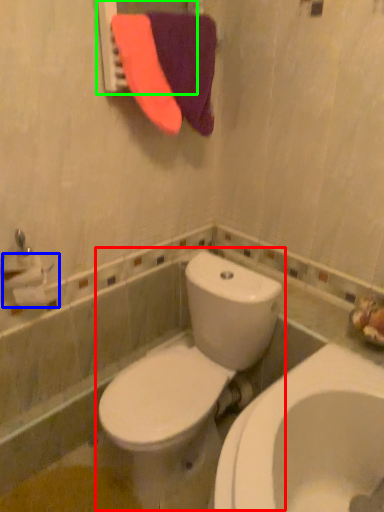
Question: Which object is the closest to the toilet (highlighted by a red box)? Choose among these: toilet paper (highlighted by a blue box) or mirror (highlighted by a green box).

Choices:
 (A) toilet paper
 (B) mirror

Answer: (A)